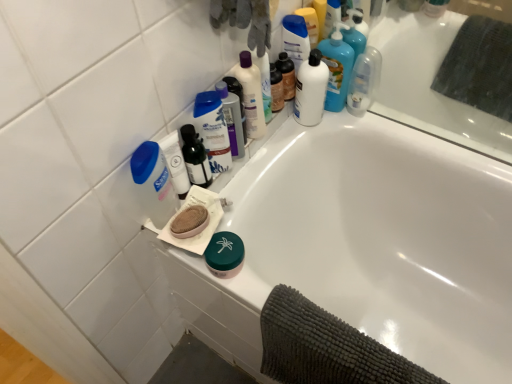
Image resolution: width=512 pixels, height=384 pixels. Describe the element at coordinates (326, 347) in the screenshot. I see `dark gray textured towel at lower right` at that location.

This screenshot has width=512, height=384. Describe the element at coordinates (265, 84) in the screenshot. I see `translucent plastic bottle at upper center, marked as the 3th cleaning product in a right-to-left arrangement` at that location.

The width and height of the screenshot is (512, 384). Describe the element at coordinates (213, 130) in the screenshot. I see `blue plastic shampoo bottle at upper center, positioned as the fifth cleaning product in right-to-left order` at that location.

Measure the distance between point (x=223, y=129) and camera.

The depth of point (x=223, y=129) is 38.35 inches.

Describe the element at coordinates (366, 245) in the screenshot. I see `white glossy bathtub at upper center` at that location.

Find the location of a particular element. translucent plastic bottle at upper center, the 4th cleaning product when ordered from right to left is located at coordinates (251, 95).

Looking at their sizes, would you say blue plastic mouthwash at upper center, acting as the second mouthwash starting from the left, is wider or thinner than dark gray textured towel at lower right?

blue plastic mouthwash at upper center, acting as the second mouthwash starting from the left, is thinner than dark gray textured towel at lower right.

From a real-world perspective, which is physically below, blue plastic mouthwash at upper center, acting as the second mouthwash starting from the left, or dark gray textured towel at lower right?

From a 3D spatial view, dark gray textured towel at lower right is below.

From the image's perspective, is blue plastic mouthwash at upper center, placed as the 3th mouthwash when sorted from right to left, located above or below dark gray textured towel at lower right?

Clearly, from the image's perspective, blue plastic mouthwash at upper center, placed as the 3th mouthwash when sorted from right to left, is above dark gray textured towel at lower right.

Does white glossy bottle at upper right, marked as the sixth cleaning product in a left-to-right arrangement, appear on the left side of matte black bottle at upper center, the 2th toiletry positioned from the left?

In fact, white glossy bottle at upper right, marked as the sixth cleaning product in a left-to-right arrangement, is to the right of matte black bottle at upper center, the 2th toiletry positioned from the left.

Locate an element on the screen. Image resolution: width=512 pixels, height=384 pixels. toiletry that is under the white glossy bottle at upper right, arranged as the first cleaning product when viewed from the right (from a real-world perspective) is located at coordinates click(286, 75).

Is white glossy bottle at upper right, arranged as the first cleaning product when viewed from the right, not near matte black bottle at upper center, the 2th toiletry positioned from the left?

white glossy bottle at upper right, arranged as the first cleaning product when viewed from the right, is actually quite close to matte black bottle at upper center, the 2th toiletry positioned from the left.

How many degrees apart are the facing directions of white glossy bottle at upper right, marked as the sixth cleaning product in a left-to-right arrangement, and matte black bottle at upper center, the 1th toiletry viewed from the back?

91.4 degrees.

In terms of height, does white plastic bottle at upper center, arranged as the 5th cleaning product when viewed from the left, look taller or shorter compared to white glossy bathtub at upper center?

Considering their sizes, white plastic bottle at upper center, arranged as the 5th cleaning product when viewed from the left, has less height than white glossy bathtub at upper center.

Is white glossy bathtub at upper center a part of white plastic bottle at upper center, the 2th cleaning product in the right-to-left sequence?

Actually, white glossy bathtub at upper center is outside white plastic bottle at upper center, the 2th cleaning product in the right-to-left sequence.

Can you confirm if white plastic bottle at upper center, the 2th cleaning product in the right-to-left sequence, is bigger than white glossy bathtub at upper center?

Actually, white plastic bottle at upper center, the 2th cleaning product in the right-to-left sequence, might be smaller than white glossy bathtub at upper center.

From a real-world perspective, is white plastic bottle at upper center, arranged as the 5th cleaning product when viewed from the left, positioned above or below white glossy bathtub at upper center?

white plastic bottle at upper center, arranged as the 5th cleaning product when viewed from the left, is above white glossy bathtub at upper center.

Who is taller, translucent plastic bottle at upper center, marked as the 3th cleaning product in a right-to-left arrangement, or white glossy bottle at upper right, marked as the sixth cleaning product in a left-to-right arrangement?

white glossy bottle at upper right, marked as the sixth cleaning product in a left-to-right arrangement, is taller.

Where is `cleaning product that is the 1st object located below the white glossy bottle at upper right, marked as the sixth cleaning product in a left-to-right arrangement (from the image's perspective)`? cleaning product that is the 1st object located below the white glossy bottle at upper right, marked as the sixth cleaning product in a left-to-right arrangement (from the image's perspective) is located at coordinates (265, 84).

In the scene shown: Which is in front, translucent plastic bottle at upper center, the 4th cleaning product in the left-to-right sequence, or white glossy bottle at upper right, arranged as the first cleaning product when viewed from the right?

translucent plastic bottle at upper center, the 4th cleaning product in the left-to-right sequence, is closer to the camera.

Is point (255, 58) farther from camera compared to point (324, 107)?

No, it is in front of (324, 107).

Is matte black bottle at upper center, the 2th toiletry positioned from the left, far away from clear plastic bottle at upper right, marked as the fourth mouthwash in a left-to-right arrangement?

matte black bottle at upper center, the 2th toiletry positioned from the left, is near clear plastic bottle at upper right, marked as the fourth mouthwash in a left-to-right arrangement, not far away.

Consider the image. Can you confirm if matte black bottle at upper center, which is the first toiletry from right to left, is positioned to the right of clear plastic bottle at upper right, marked as the fourth mouthwash in a left-to-right arrangement?

Incorrect, matte black bottle at upper center, which is the first toiletry from right to left, is not on the right side of clear plastic bottle at upper right, marked as the fourth mouthwash in a left-to-right arrangement.

Considering the points (280, 55) and (353, 78), which point is in front, point (280, 55) or point (353, 78)?

The point (280, 55) is in front.

Is matte black bottle at upper center, the 1th toiletry in the top-to-bottom sequence, taller than clear plastic bottle at upper right, marked as the 1th mouthwash in a right-to-left arrangement?

No.

Between point (225, 107) and point (163, 217), which one is positioned in front?

Positioned in front is point (163, 217).

Looking at this image, is blue plastic mouthwash at upper center, acting as the second mouthwash starting from the left, aimed at translucent plastic soap dispenser at upper left, which is the first cleaning product from left to right?

No, blue plastic mouthwash at upper center, acting as the second mouthwash starting from the left, does not turn towards translucent plastic soap dispenser at upper left, which is the first cleaning product from left to right.

Is blue plastic mouthwash at upper center, placed as the 3th mouthwash when sorted from right to left, far away from translucent plastic soap dispenser at upper left, which is the first cleaning product from left to right?

That's not correct — blue plastic mouthwash at upper center, placed as the 3th mouthwash when sorted from right to left, is a little close to translucent plastic soap dispenser at upper left, which is the first cleaning product from left to right.

From the image's perspective, is dark gray textured towel at lower right located above or below translucent plastic soap dispenser at upper left, which is the 6th cleaning product in right-to-left order?

dark gray textured towel at lower right is situated lower than translucent plastic soap dispenser at upper left, which is the 6th cleaning product in right-to-left order, in the image.

Does point (326, 366) come in front of point (133, 154)?

No, it is behind (133, 154).

The height and width of the screenshot is (384, 512). In order to click on bath towel below the translucent plastic soap dispenser at upper left, which is the 6th cleaning product in right-to-left order (from the image's perspective) in this screenshot , I will do `click(326, 347)`.

Which object is positioned more to the left, dark gray textured towel at lower right or translucent plastic soap dispenser at upper left, which is the 6th cleaning product in right-to-left order?

Positioned to the left is translucent plastic soap dispenser at upper left, which is the 6th cleaning product in right-to-left order.

Locate an element on the screen. This screenshot has height=384, width=512. bath towel on the right of blue plastic mouthwash at upper center, acting as the second mouthwash starting from the left is located at coordinates (326, 347).

From a real-world perspective, starting from the matte black bottle at upper center, the 2th toiletry positioned from the left, which cleaning product is the 1st one vertically above it? Please provide its 2D coordinates.

[(337, 68)]

From the image, which object appears to be farther from blue plastic bottle at upper left, which is the 1th mouthwash from left to right, matte black bottle at upper center, acting as the 2th toiletry starting from the front, or white plastic bottle at upper center, the 2th cleaning product in the right-to-left sequence?

white plastic bottle at upper center, the 2th cleaning product in the right-to-left sequence, lies further to blue plastic bottle at upper left, which is the 1th mouthwash from left to right, than the other object.

Which object lies nearer to the anchor point white glossy bathtub at upper center, blue plastic mouthwash at upper center, placed as the 3th mouthwash when sorted from right to left, or white glossy bottle at upper right, marked as the sixth cleaning product in a left-to-right arrangement?

Among the two, white glossy bottle at upper right, marked as the sixth cleaning product in a left-to-right arrangement, is located nearer to white glossy bathtub at upper center.

Looking at the image, which one is located further to blue plastic mouthwash at upper center, acting as the second mouthwash starting from the left, clear plastic bottle at upper right, marked as the fourth mouthwash in a left-to-right arrangement, or translucent plastic bottle at upper center, marked as the 3th cleaning product in a right-to-left arrangement?

clear plastic bottle at upper right, marked as the fourth mouthwash in a left-to-right arrangement.

Considering their positions, is clear plastic bottle at upper right, marked as the fourth mouthwash in a left-to-right arrangement, positioned closer to matte black bottle at upper center, the second toiletry positioned from the bottom, than white glossy bottle at upper center, acting as the 3th mouthwash starting from the left?

white glossy bottle at upper center, acting as the 3th mouthwash starting from the left, is positioned closer to the anchor matte black bottle at upper center, the second toiletry positioned from the bottom.

Which object lies nearer to the anchor point blue plastic mouthwash at upper center, placed as the 3th mouthwash when sorted from right to left, translucent plastic bottle at upper center, placed as the second toiletry when sorted from top to bottom, or translucent plastic soap dispenser at upper left, which is the 6th cleaning product in right-to-left order?

Among the two, translucent plastic bottle at upper center, placed as the second toiletry when sorted from top to bottom, is located nearer to blue plastic mouthwash at upper center, placed as the 3th mouthwash when sorted from right to left.

Considering their positions, is translucent plastic bottle at upper center, the 4th cleaning product when ordered from right to left, positioned further to matte black bottle at upper center, the 2th toiletry positioned from the left, than blue plastic mouthwash at upper center, placed as the 3th mouthwash when sorted from right to left?

blue plastic mouthwash at upper center, placed as the 3th mouthwash when sorted from right to left, lies further to matte black bottle at upper center, the 2th toiletry positioned from the left, than the other object.

Looking at the image, which one is located closer to clear plastic bottle at upper right, marked as the fourth mouthwash in a left-to-right arrangement, white glossy bottle at upper center, arranged as the 2th mouthwash when viewed from the right, or translucent plastic bottle at upper center, the 4th cleaning product in the left-to-right sequence?

white glossy bottle at upper center, arranged as the 2th mouthwash when viewed from the right.

In the scene shown: Based on their spatial positions, is blue plastic bottle at upper left, the 4th mouthwash from the right, or translucent plastic bottle at upper center, the second toiletry from the right, further from white glossy bottle at upper right, arranged as the first cleaning product when viewed from the right?

blue plastic bottle at upper left, the 4th mouthwash from the right, is positioned further to the anchor white glossy bottle at upper right, arranged as the first cleaning product when viewed from the right.

The height and width of the screenshot is (384, 512). In order to click on bathtub between white plastic bottle at upper center, the 2th cleaning product in the right-to-left sequence, and dark gray textured towel at lower right in the up-down direction in this screenshot , I will do [x=366, y=245].

This screenshot has height=384, width=512. I want to click on toiletry between translucent plastic bottle at upper center, the 4th cleaning product in the left-to-right sequence, and white glossy bottle at upper right, marked as the sixth cleaning product in a left-to-right arrangement, so click(x=286, y=75).

Locate an element on the screen. Image resolution: width=512 pixels, height=384 pixels. mouthwash between translucent plastic bottle at upper center, the 4th cleaning product when ordered from right to left, and clear plastic bottle at upper right, marked as the 1th mouthwash in a right-to-left arrangement, from left to right is located at coordinates (311, 90).

Locate an element on the screen. toiletry between translucent plastic bottle at upper center, the 4th cleaning product when ordered from right to left, and dark gray textured towel at lower right in the up-down direction is located at coordinates (195, 157).